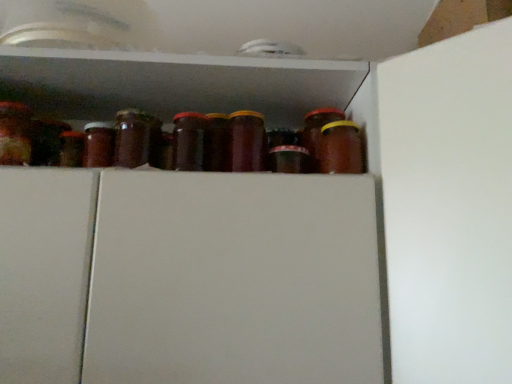
The height and width of the screenshot is (384, 512). What do you see at coordinates (246, 142) in the screenshot?
I see `brown glass jar at center, acting as the second bottle starting from the right` at bounding box center [246, 142].

Where is `brown glass jar at center, which is counted as the 1th bottle, starting from the left`? This screenshot has height=384, width=512. brown glass jar at center, which is counted as the 1th bottle, starting from the left is located at coordinates [246, 142].

Where is `brown glass jar at center-right, which is the 2th bottle in left-to-right order`? Image resolution: width=512 pixels, height=384 pixels. brown glass jar at center-right, which is the 2th bottle in left-to-right order is located at coordinates (340, 148).

Describe the element at coordinates (340, 148) in the screenshot. I see `brown glass jar at center-right, which is the first bottle from right to left` at that location.

This screenshot has height=384, width=512. Find the location of `brown glass jar at center, which is counted as the 1th bottle, starting from the left`. brown glass jar at center, which is counted as the 1th bottle, starting from the left is located at coordinates (246, 142).

Is brown glass jar at center, which is counted as the 1th bottle, starting from the left, at the left side of brown glass jar at center-right, which is the 2th bottle in left-to-right order?

Yes, brown glass jar at center, which is counted as the 1th bottle, starting from the left, is to the left of brown glass jar at center-right, which is the 2th bottle in left-to-right order.

Which object is closer to the camera, brown glass jar at center, which is counted as the 1th bottle, starting from the left, or brown glass jar at center-right, which is the first bottle from right to left?

brown glass jar at center, which is counted as the 1th bottle, starting from the left, is more forward.

Is point (242, 156) behind point (340, 149)?

Yes.

From the image's perspective, which is above, brown glass jar at center, acting as the second bottle starting from the right, or brown glass jar at center-right, which is the 2th bottle in left-to-right order?

brown glass jar at center, acting as the second bottle starting from the right, is shown above in the image.

From a real-world perspective, is brown glass jar at center, which is counted as the 1th bottle, starting from the left, positioned above or below brown glass jar at center-right, which is the 2th bottle in left-to-right order?

Clearly, from a real-world perspective, brown glass jar at center, which is counted as the 1th bottle, starting from the left, is above brown glass jar at center-right, which is the 2th bottle in left-to-right order.

Which object is thinner, brown glass jar at center, which is counted as the 1th bottle, starting from the left, or brown glass jar at center-right, which is the 2th bottle in left-to-right order?

brown glass jar at center, which is counted as the 1th bottle, starting from the left.

In the scene shown: Is brown glass jar at center, which is counted as the 1th bottle, starting from the left, taller or shorter than brown glass jar at center-right, which is the 2th bottle in left-to-right order?

brown glass jar at center, which is counted as the 1th bottle, starting from the left, is taller than brown glass jar at center-right, which is the 2th bottle in left-to-right order.

Is brown glass jar at center, acting as the second bottle starting from the right, bigger than brown glass jar at center-right, which is the 2th bottle in left-to-right order?

Indeed, brown glass jar at center, acting as the second bottle starting from the right, has a larger size compared to brown glass jar at center-right, which is the 2th bottle in left-to-right order.

Is brown glass jar at center, acting as the second bottle starting from the right, inside the boundaries of brown glass jar at center-right, which is the 2th bottle in left-to-right order, or outside?

brown glass jar at center, acting as the second bottle starting from the right, is not inside brown glass jar at center-right, which is the 2th bottle in left-to-right order, it's outside.

Is the surface of brown glass jar at center, acting as the second bottle starting from the right, in direct contact with brown glass jar at center-right, which is the 2th bottle in left-to-right order?

No, brown glass jar at center, acting as the second bottle starting from the right, is not next to brown glass jar at center-right, which is the 2th bottle in left-to-right order.

In the scene shown: Could you tell me if brown glass jar at center, acting as the second bottle starting from the right, is turned towards brown glass jar at center-right, which is the 2th bottle in left-to-right order?

No, brown glass jar at center, acting as the second bottle starting from the right, is not aimed at brown glass jar at center-right, which is the 2th bottle in left-to-right order.

Measure the distance between brown glass jar at center, which is counted as the 1th bottle, starting from the left, and brown glass jar at center-right, which is the 2th bottle in left-to-right order.

brown glass jar at center, which is counted as the 1th bottle, starting from the left, and brown glass jar at center-right, which is the 2th bottle in left-to-right order, are 14.28 centimeters apart from each other.

Identify the location of bottle that appears in front of the brown glass jar at center-right, which is the 2th bottle in left-to-right order. The height and width of the screenshot is (384, 512). (246, 142).

Would you say brown glass jar at center-right, which is the 2th bottle in left-to-right order, is to the left or to the right of brown glass jar at center, which is counted as the 1th bottle, starting from the left, in the picture?

brown glass jar at center-right, which is the 2th bottle in left-to-right order, is positioned on brown glass jar at center, which is counted as the 1th bottle, starting from the left,'s right side.

Is the depth of brown glass jar at center-right, which is the 2th bottle in left-to-right order, less than that of brown glass jar at center, which is counted as the 1th bottle, starting from the left?

No, it is behind brown glass jar at center, which is counted as the 1th bottle, starting from the left.

Between point (344, 132) and point (248, 137), which one is positioned in front?

The point (344, 132) is in front.

From the image's perspective, which one is positioned higher, brown glass jar at center-right, which is the first bottle from right to left, or brown glass jar at center, which is counted as the 1th bottle, starting from the left?

brown glass jar at center, which is counted as the 1th bottle, starting from the left, appears higher in the image.

From a real-world perspective, is brown glass jar at center-right, which is the 2th bottle in left-to-right order, above or below brown glass jar at center, which is counted as the 1th bottle, starting from the left?

In terms of real-world spatial position, brown glass jar at center-right, which is the 2th bottle in left-to-right order, is below brown glass jar at center, which is counted as the 1th bottle, starting from the left.

Which object is thinner, brown glass jar at center-right, which is the first bottle from right to left, or brown glass jar at center, acting as the second bottle starting from the right?

brown glass jar at center, acting as the second bottle starting from the right, is thinner.

Can you confirm if brown glass jar at center-right, which is the first bottle from right to left, is shorter than brown glass jar at center, acting as the second bottle starting from the right?

Correct, brown glass jar at center-right, which is the first bottle from right to left, is not as tall as brown glass jar at center, acting as the second bottle starting from the right.

Who is smaller, brown glass jar at center-right, which is the first bottle from right to left, or brown glass jar at center, which is counted as the 1th bottle, starting from the left?

Smaller between the two is brown glass jar at center-right, which is the first bottle from right to left.

Is brown glass jar at center, acting as the second bottle starting from the right, located within brown glass jar at center-right, which is the 2th bottle in left-to-right order?

No, brown glass jar at center, acting as the second bottle starting from the right, is not a part of brown glass jar at center-right, which is the 2th bottle in left-to-right order.

Is brown glass jar at center-right, which is the first bottle from right to left, positioned far away from brown glass jar at center, acting as the second bottle starting from the right?

No, there isn't a large distance between brown glass jar at center-right, which is the first bottle from right to left, and brown glass jar at center, acting as the second bottle starting from the right.

Is brown glass jar at center-right, which is the first bottle from right to left, looking in the opposite direction of brown glass jar at center, acting as the second bottle starting from the right?

No, brown glass jar at center, acting as the second bottle starting from the right, is not at the back of brown glass jar at center-right, which is the first bottle from right to left.

How many degrees apart are the facing directions of brown glass jar at center-right, which is the first bottle from right to left, and brown glass jar at center, acting as the second bottle starting from the right?

There is a 0.000148-degree angle between the facing directions of brown glass jar at center-right, which is the first bottle from right to left, and brown glass jar at center, acting as the second bottle starting from the right.

Could you measure the distance between brown glass jar at center-right, which is the 2th bottle in left-to-right order, and brown glass jar at center, acting as the second bottle starting from the right?

brown glass jar at center-right, which is the 2th bottle in left-to-right order, is 5.62 inches from brown glass jar at center, acting as the second bottle starting from the right.

You are a GUI agent. You are given a task and a screenshot of the screen. Output one action in this format:
    pyautogui.click(x=<x>, y=<y>)
    Task: Click on the bottle located behind the brown glass jar at center, acting as the second bottle starting from the right
    The height and width of the screenshot is (384, 512).
    Given the screenshot: What is the action you would take?
    pyautogui.click(x=340, y=148)

At what (x,y) coordinates should I click in order to perform the action: click on bottle below the brown glass jar at center, which is counted as the 1th bottle, starting from the left (from a real-world perspective). Please return your answer as a coordinate pair (x, y). This screenshot has height=384, width=512. Looking at the image, I should click on [340, 148].

The width and height of the screenshot is (512, 384). Identify the location of bottle behind the brown glass jar at center, acting as the second bottle starting from the right. (340, 148).